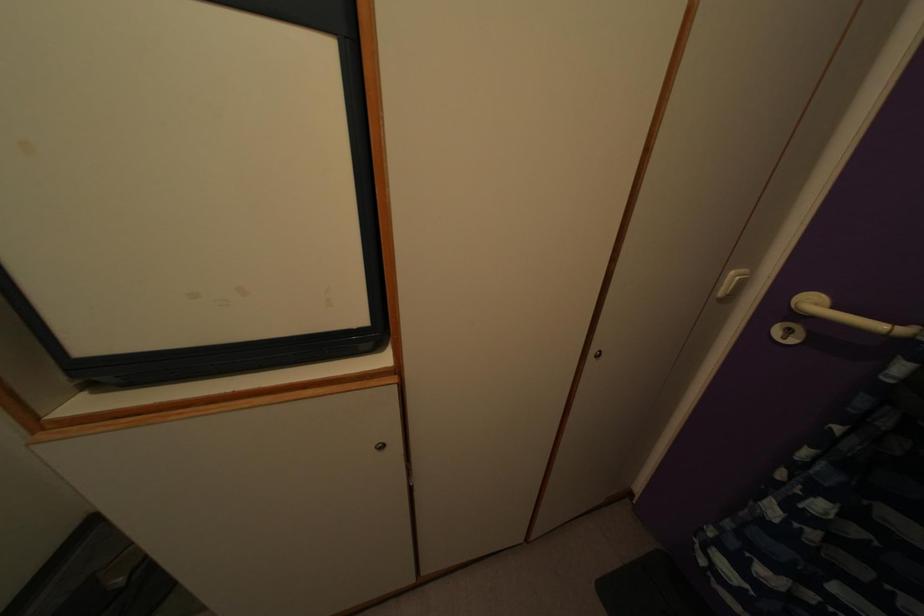
Identify the location of door keyhole. The height and width of the screenshot is (616, 924). (598, 354).